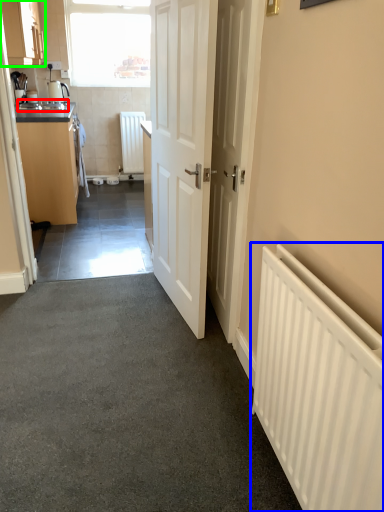
Question: Which object is the farthest from sink (highlighted by a red box)? Choose among these: radiator (highlighted by a blue box) or cabinetry (highlighted by a green box).

Choices:
 (A) radiator
 (B) cabinetry

Answer: (A)